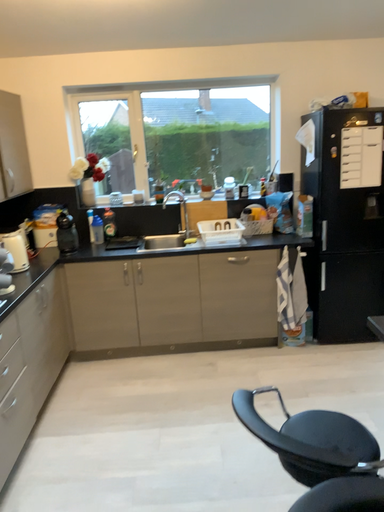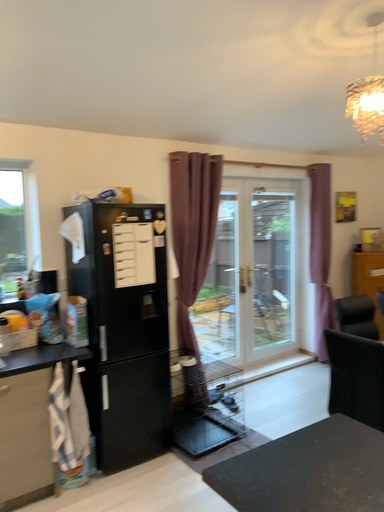
Question: Which way did the camera rotate in the video?

Choices:
 (A) rotated left
 (B) rotated right

Answer: (B)